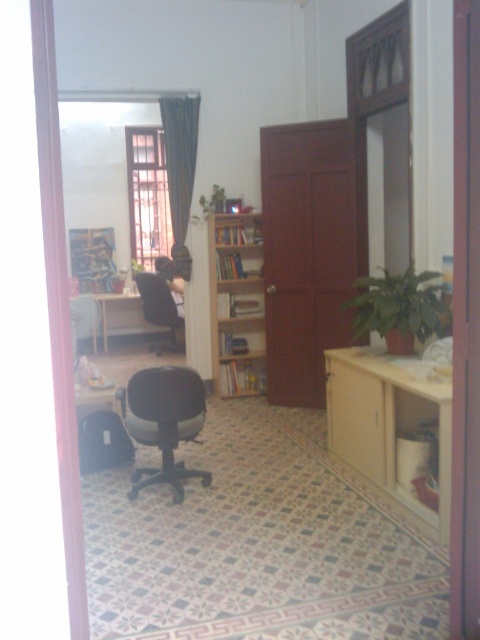
Measure the distance between light brown wooden bookshelf at center and dark green fabric curtain at upper center.

A distance of 28.33 inches exists between light brown wooden bookshelf at center and dark green fabric curtain at upper center.

Does light brown wooden bookshelf at center appear on the left side of dark green fabric curtain at upper center?

Incorrect, light brown wooden bookshelf at center is not on the left side of dark green fabric curtain at upper center.

Find the location of a particular element. The width and height of the screenshot is (480, 640). light brown wooden bookshelf at center is located at coordinates (237, 304).

Where is `light brown wooden bookshelf at center`? The image size is (480, 640). light brown wooden bookshelf at center is located at coordinates (237, 304).

Can you confirm if matte black swivel chair at center is shorter than black mesh office chair at center?

Incorrect, matte black swivel chair at center's height does not fall short of black mesh office chair at center's.

Which of these two, matte black swivel chair at center or black mesh office chair at center, stands taller?

Standing taller between the two is matte black swivel chair at center.

Is point (126, 408) behind point (157, 342)?

No, it is not.

Identify the location of matte black swivel chair at center. (164, 420).

Does light brown wooden bookshelf at center have a smaller size compared to matte black swivel chair at center?

Yes.

Who is more distant from viewer, (264, 353) or (144, 442)?

The point (264, 353) is more distant.

Find the location of a particular element. light brown wooden bookshelf at center is located at coordinates (237, 304).

Locate an element on the screen. The height and width of the screenshot is (640, 480). light brown wooden bookshelf at center is located at coordinates point(237,304).